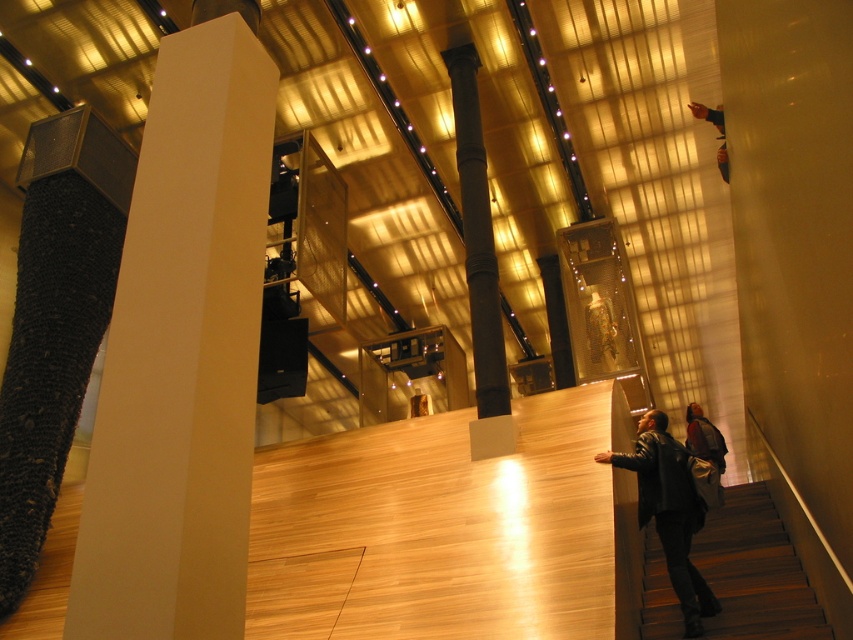
Based on the photo, you are standing in the modern interior space and want to place a dark brown leather jacket at lower right. The jacket requires a spot that is not directly under the ambient lighting to avoid fading. Can you confirm if the location at point (704,436) is suitable?

The dark brown leather jacket at lower right is located at point (704,436). Since the ambient lighting is strategically placed to highlight architectural details and exhibits, it is possible that this area receives less direct light. However, without specific information about the exact lighting at that point, I cannot confirm if it is suitable. Please check the lighting intensity there before placing the jacket.

Looking at this image, you are standing in the modern interior space and see the dark brown leather jacket at lower right and the blue fabric at upper right. Which object is positioned more to the right side of the scene?

The dark brown leather jacket at lower right is positioned to the right of the blue fabric at upper right, so it is more to the right side of the scene.